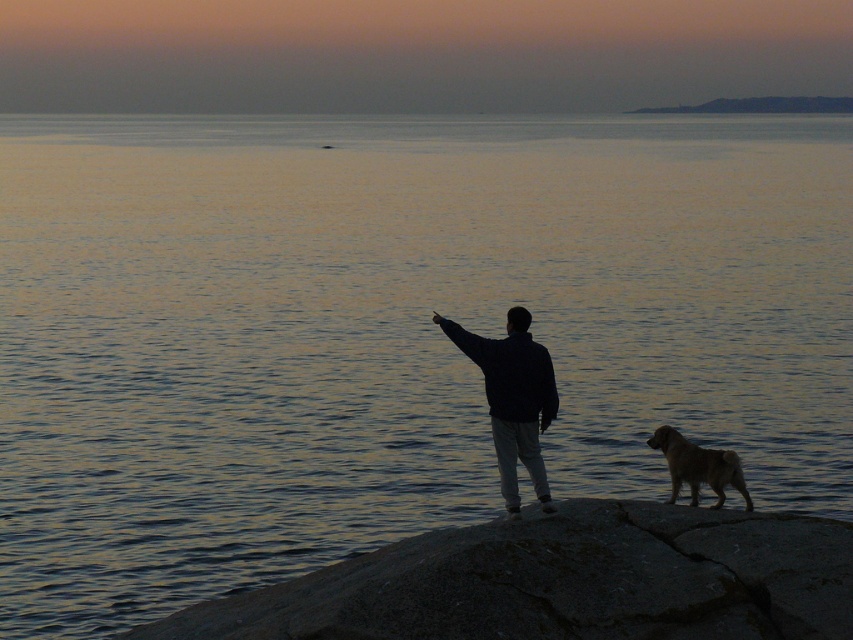
Who is positioned more to the left, smooth orange sky at upper center or gray rough rock at lower center?

Positioned to the left is smooth orange sky at upper center.

Can you confirm if smooth orange sky at upper center is positioned to the left of gray rough rock at lower center?

Indeed, smooth orange sky at upper center is positioned on the left side of gray rough rock at lower center.

Between point (10, 108) and point (636, 579), which one is positioned behind?

Positioned behind is point (10, 108).

Locate an element on the screen. This screenshot has width=853, height=640. smooth orange sky at upper center is located at coordinates (415, 52).

Is gray rough rock at lower center taller than black matte jacket at center?

In fact, gray rough rock at lower center may be shorter than black matte jacket at center.

Does gray rough rock at lower center have a greater width compared to black matte jacket at center?

Yes.

Is point (376, 627) closer to camera compared to point (515, 502)?

Yes, point (376, 627) is in front of point (515, 502).

I want to click on gray rough rock at lower center, so click(x=563, y=580).

Who is higher up, gray rough rock at lower center or golden fur dog at lower right?

Positioned higher is golden fur dog at lower right.

This screenshot has height=640, width=853. What do you see at coordinates (563, 580) in the screenshot? I see `gray rough rock at lower center` at bounding box center [563, 580].

Which is in front, point (776, 538) or point (689, 483)?

Point (776, 538) is more forward.

Locate an element on the screen. This screenshot has width=853, height=640. gray rough rock at lower center is located at coordinates (563, 580).